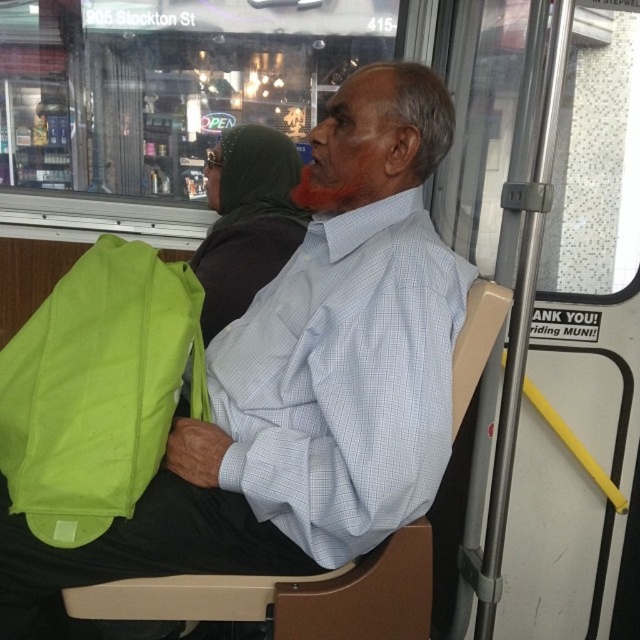
You are a passenger on a bus and need to place a book between the green fabric bag at left and the matte green bag at lower left. Which bag should you place it closer to if you want the book to be higher?

The matte green bag at lower left is taller than the green fabric bag at left, so placing the book closer to the matte green bag at lower left would result in the book being higher.

You are a passenger on a bus and need to retrieve your matte green bag at lower left from under the seat. Is the green fabric bag at left in your way?

The green fabric bag at left is located above the matte green bag at lower left, so it is blocking access to the matte green bag at lower left. You will need to move the green fabric bag at left first to reach the matte green bag at lower left.

You are standing at the entrance of the bus and want to reach the green fabric bag at left. Which direction should you move to get closer to it?

To reach the green fabric bag at left, you should move towards the left side of the bus since the bag is located at point (97,388), which is on the left side relative to the entrance.